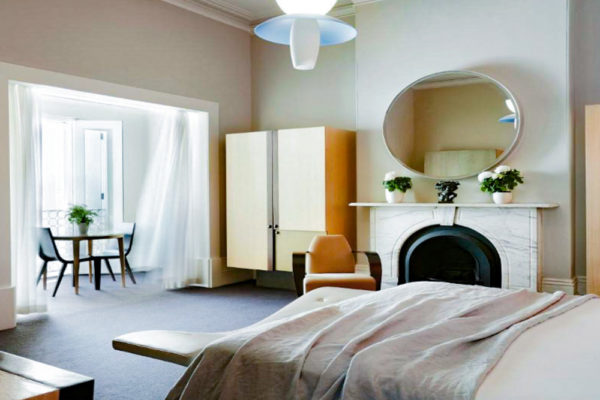
The width and height of the screenshot is (600, 400). Identify the location of chair. (49, 237), (131, 232).